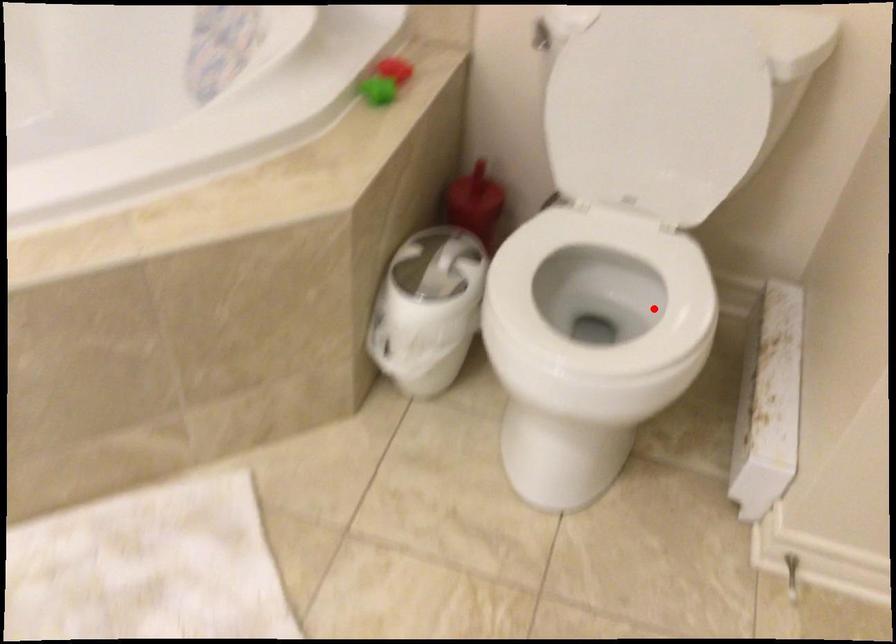
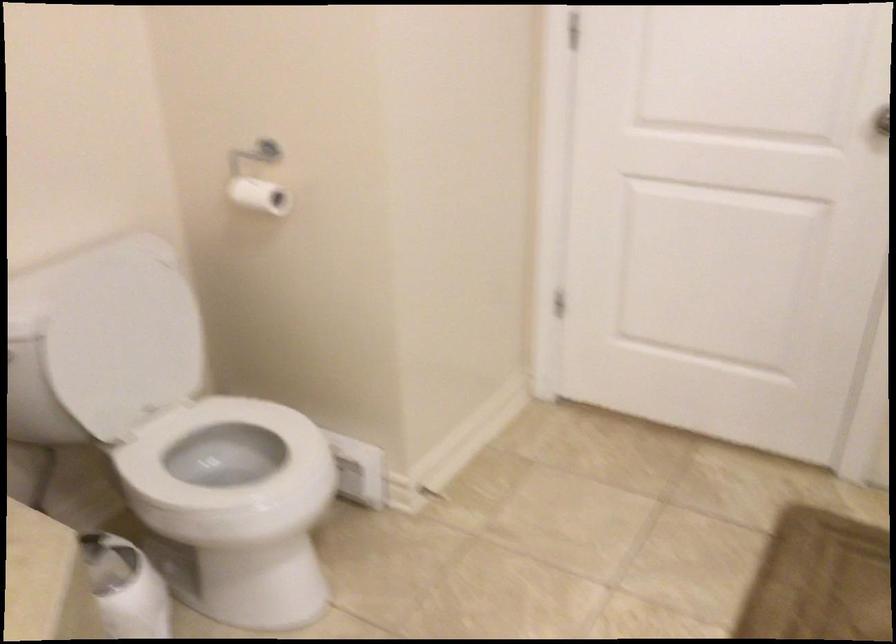
Question: I am providing you with two images of the same scene from different viewpoints. A red point is shown in image1. For the corresponding object point in image2, is it positioned nearer or farther from the camera?

Choices:
 (A) Nearer
 (B) Farther

Answer: (B)